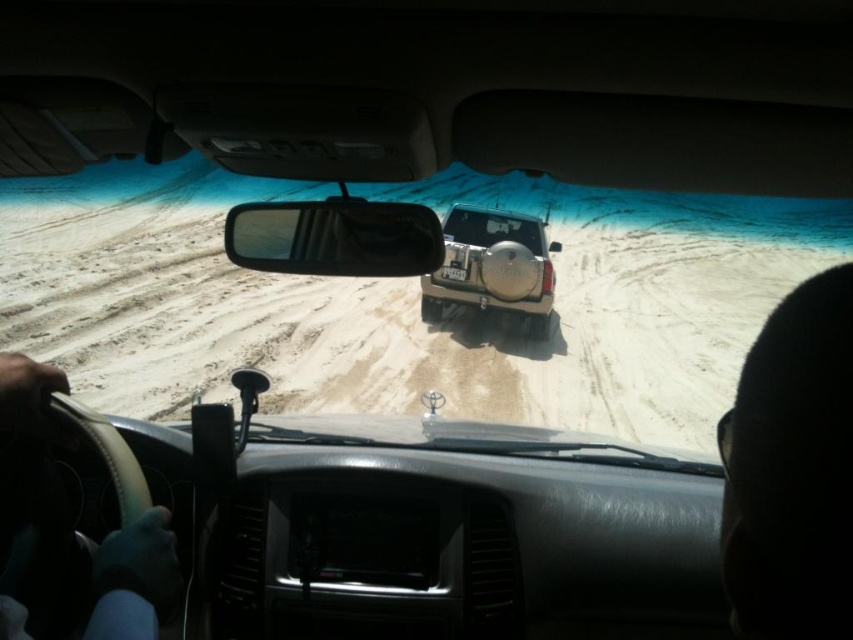
You are driving a vehicle and need to adjust the mounted device on the dashboard. To reach it, you must move your hand from the black leather steering wheel at lower left. In which direction should you move your hand relative to the steering wheel?

The black leather steering wheel at lower left is located at point (134, 579). Since the mounted device is on the dashboard, you would need to move your hand upward from the steering wheel to reach it.

You are driving a vehicle and need to stay on the white sandy dirt track at center. The clear plastic windshield at center is blocking your view. Can you adjust your steering to keep the track in view without moving the windshield?

The white sandy dirt track at center is wider than the clear plastic windshield at center, so you can adjust your steering to keep the track visible through the windshield by centering it within the wider track area.

You are driving a vehicle and want to ensure the matte beige jeep at center ahead doesn not block your view of the distant water. Given the clear glass windshield at center, can you see the water beyond the jeep?

The matte beige jeep at center is taller than the clear glass windshield at center, so the jeep will block your view of the distant water beyond it.